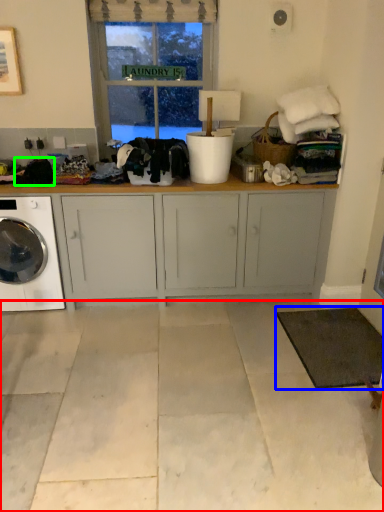
Question: Which is nearer to the concrete (highlighted by a red box)? mat (highlighted by a blue box) or clothing (highlighted by a green box).

Choices:
 (A) mat
 (B) clothing

Answer: (A)